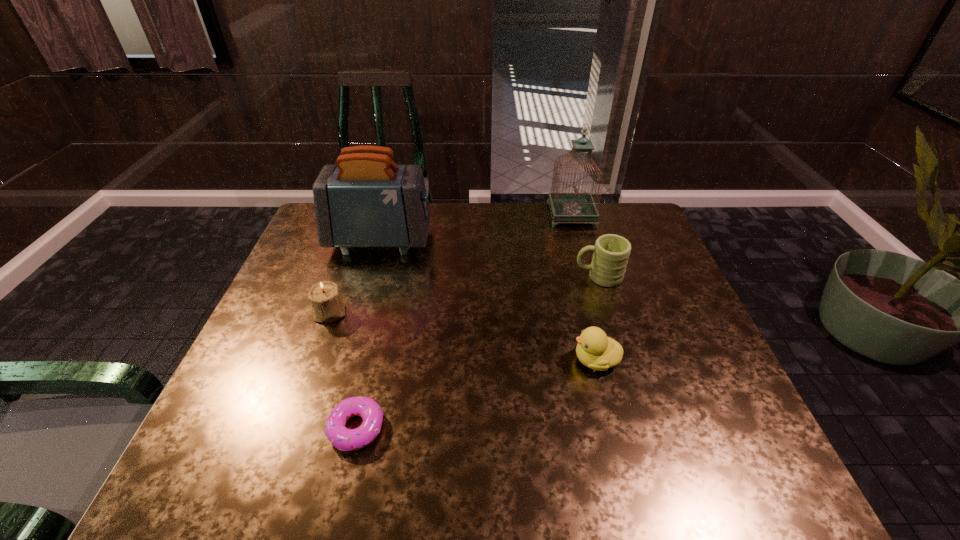
The width and height of the screenshot is (960, 540). I want to click on vacant space situated at the door of the birdcage, so click(x=492, y=215).

You are a GUI agent. You are given a task and a screenshot of the screen. Output one action in this format:
    pyautogui.click(x=<x>, y=<y>)
    Task: Click on the vacant space located on the front-facing side of the toaster
    The height and width of the screenshot is (540, 960).
    Given the screenshot: What is the action you would take?
    512,240

Find the location of a particular element. free space located 0.050m on the side of the mug with the handle is located at coordinates (557, 276).

You are a GUI agent. You are given a task and a screenshot of the screen. Output one action in this format:
    pyautogui.click(x=<x>, y=<y>)
    Task: Click on the free spot located on the side of the mug with the handle
    
    Given the screenshot: What is the action you would take?
    pyautogui.click(x=436, y=276)

Where is `vacant space located on the side of the mug with the handle`? This screenshot has width=960, height=540. vacant space located on the side of the mug with the handle is located at coordinates (436, 276).

Locate an element on the screen. The height and width of the screenshot is (540, 960). vacant space located on the back of the candle_holder is located at coordinates (361, 224).

Identify the location of blank space located at the beak of the duckling. (509, 360).

I want to click on free space located at the beak of the duckling, so pos(505,360).

Locate an element on the screen. The width and height of the screenshot is (960, 540). vacant area situated at the beak of the duckling is located at coordinates (442, 360).

Where is `free spot located on the back of the shortest object`? The image size is (960, 540). free spot located on the back of the shortest object is located at coordinates (372, 363).